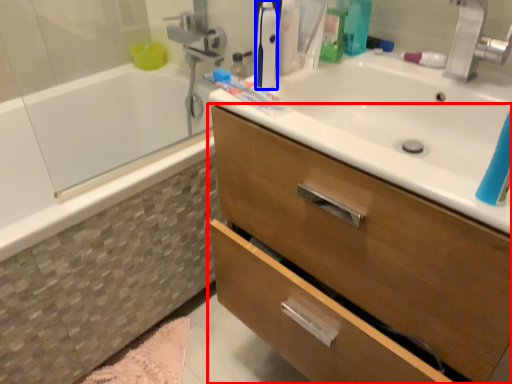
Question: Which point is further to the camera, bathroom cabinet (highlighted by a red box) or toiletry (highlighted by a blue box)?

Choices:
 (A) bathroom cabinet
 (B) toiletry

Answer: (B)